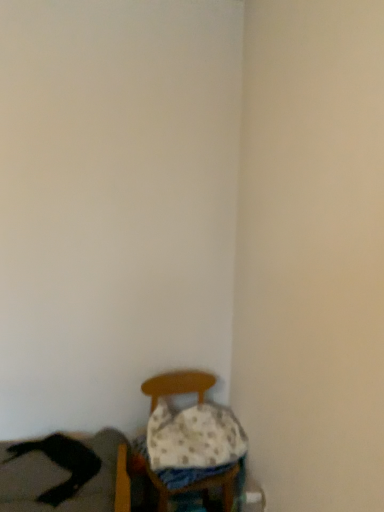
Question: From a real-world perspective, is black leather couch at lower left over white dotted fabric pillow at lower center?

Choices:
 (A) no
 (B) yes

Answer: (A)

Question: Can you confirm if black leather couch at lower left is thinner than white dotted fabric pillow at lower center?

Choices:
 (A) yes
 (B) no

Answer: (B)

Question: Is black leather couch at lower left further to the viewer compared to white dotted fabric pillow at lower center?

Choices:
 (A) yes
 (B) no

Answer: (B)

Question: Considering the relative sizes of black leather couch at lower left and white dotted fabric pillow at lower center in the image provided, is black leather couch at lower left shorter than white dotted fabric pillow at lower center?

Choices:
 (A) yes
 (B) no

Answer: (A)

Question: Is black leather couch at lower left in front of white dotted fabric pillow at lower center?

Choices:
 (A) yes
 (B) no

Answer: (A)

Question: In terms of height, does wooden chair at lower center look taller or shorter compared to white dotted fabric pillow at lower center?

Choices:
 (A) tall
 (B) short

Answer: (A)

Question: In terms of width, does wooden chair at lower center look wider or thinner when compared to white dotted fabric pillow at lower center?

Choices:
 (A) thin
 (B) wide

Answer: (B)

Question: Does point (155, 378) appear closer or farther from the camera than point (162, 421)?

Choices:
 (A) farther
 (B) closer

Answer: (A)

Question: Would you say wooden chair at lower center is inside or outside white dotted fabric pillow at lower center?

Choices:
 (A) outside
 (B) inside

Answer: (A)

Question: Would you say black leather couch at lower left is inside or outside wooden chair at lower center?

Choices:
 (A) inside
 (B) outside

Answer: (B)

Question: Is black leather couch at lower left taller or shorter than wooden chair at lower center?

Choices:
 (A) short
 (B) tall

Answer: (A)

Question: Looking at the image, does black leather couch at lower left seem bigger or smaller compared to wooden chair at lower center?

Choices:
 (A) small
 (B) big

Answer: (A)

Question: Considering the positions of black leather couch at lower left and wooden chair at lower center in the image, is black leather couch at lower left wider or thinner than wooden chair at lower center?

Choices:
 (A) wide
 (B) thin

Answer: (A)

Question: Considering the positions of point (162, 423) and point (162, 380), is point (162, 423) closer or farther from the camera than point (162, 380)?

Choices:
 (A) closer
 (B) farther

Answer: (A)

Question: Based on their sizes in the image, would you say white dotted fabric pillow at lower center is bigger or smaller than wooden chair at lower center?

Choices:
 (A) big
 (B) small

Answer: (B)